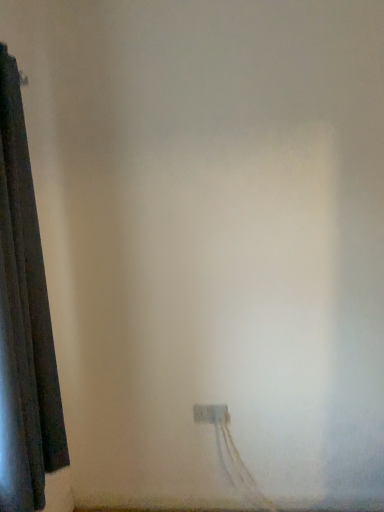
Question: Based on their sizes in the image, would you say white plastic power plugs and sockets at lower center is bigger or smaller than dark fabric curtain at left?

Choices:
 (A) small
 (B) big

Answer: (A)

Question: From the image's perspective, is white plastic power plugs and sockets at lower center positioned above or below dark fabric curtain at left?

Choices:
 (A) above
 (B) below

Answer: (B)

Question: Is white plastic power plugs and sockets at lower center to the left or to the right of dark fabric curtain at left in the image?

Choices:
 (A) left
 (B) right

Answer: (B)

Question: Which is correct: dark fabric curtain at left is inside white plastic power plugs and sockets at lower center, or outside of it?

Choices:
 (A) outside
 (B) inside

Answer: (A)

Question: Considering the relative positions of dark fabric curtain at left and white plastic power plugs and sockets at lower center in the image provided, is dark fabric curtain at left to the left or to the right of white plastic power plugs and sockets at lower center?

Choices:
 (A) right
 (B) left

Answer: (B)

Question: Based on their sizes in the image, would you say dark fabric curtain at left is bigger or smaller than white plastic power plugs and sockets at lower center?

Choices:
 (A) small
 (B) big

Answer: (B)

Question: From a real-world perspective, is dark fabric curtain at left above or below white plastic power plugs and sockets at lower center?

Choices:
 (A) below
 (B) above

Answer: (B)